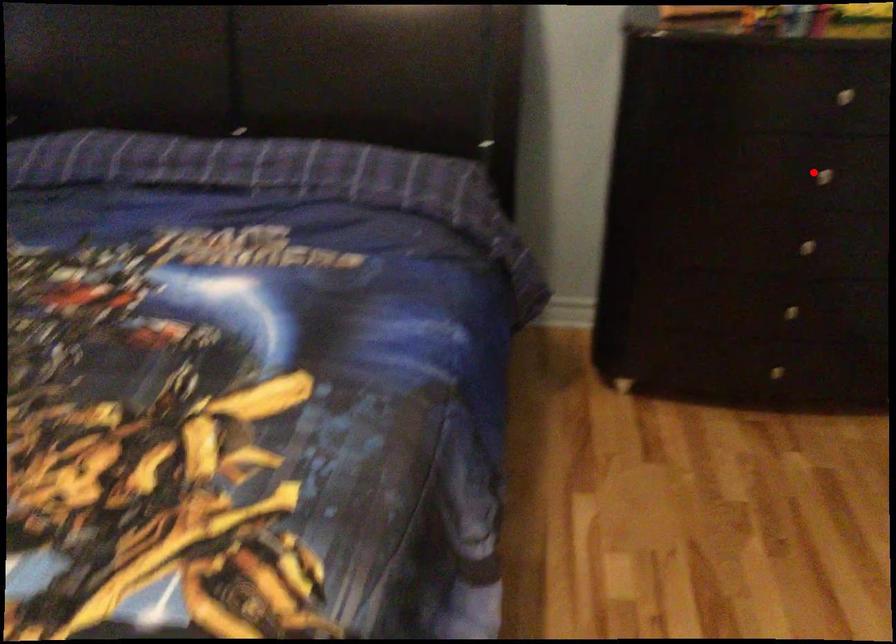
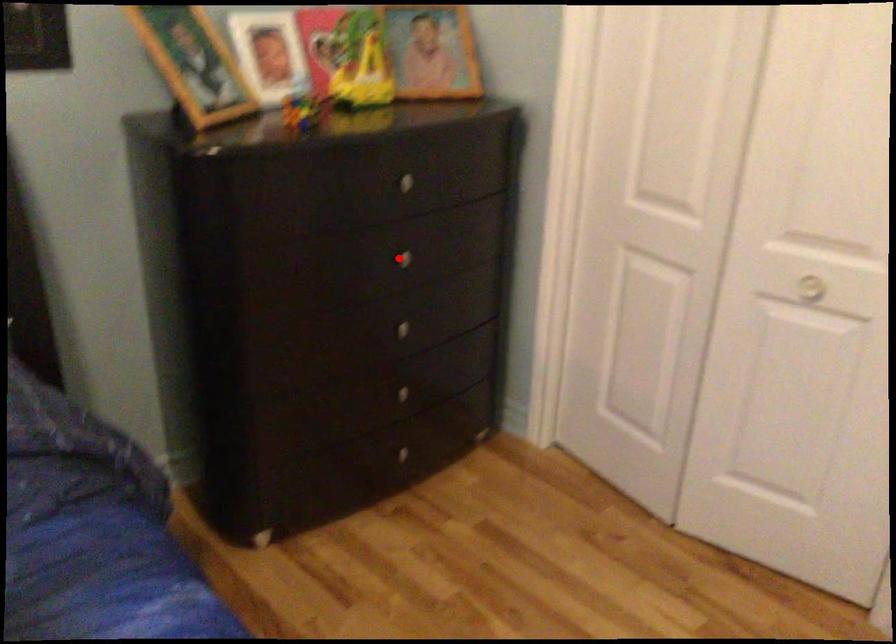
I am providing you with two images of the same scene from different viewpoints. A red point is marked on the first image and another point is marked on the second image. Do the highlighted points in image1 and image2 indicate the same real-world spot?

Yes